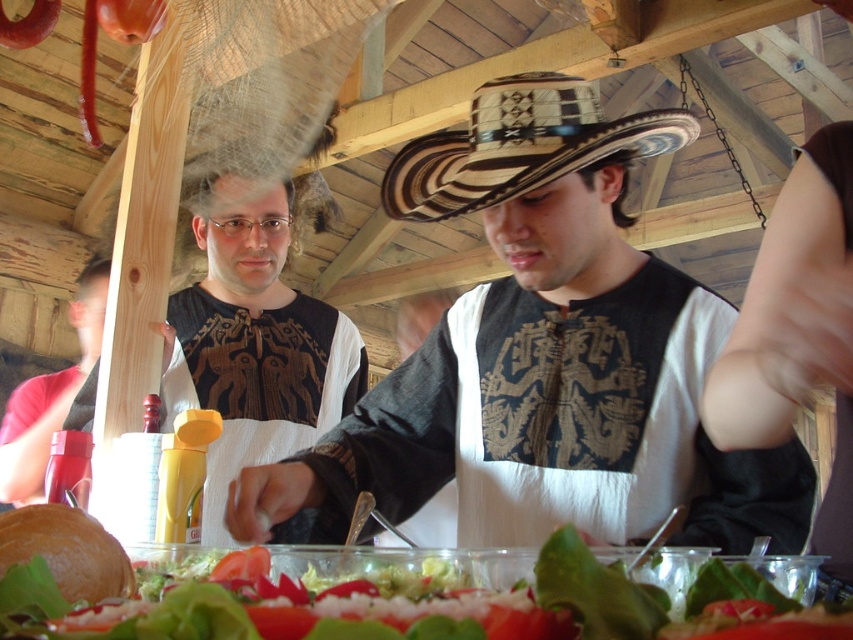
Is point (599, 266) less distant than point (419, 172)?

That is True.

Is matte black vest at center taller than brown woven straw cowboy hat at center?

Correct, matte black vest at center is much taller as brown woven straw cowboy hat at center.

Measure the distance between matte black vest at center and camera.

matte black vest at center is 29.62 inches away from camera.

The image size is (853, 640). I want to click on matte black vest at center, so click(x=543, y=356).